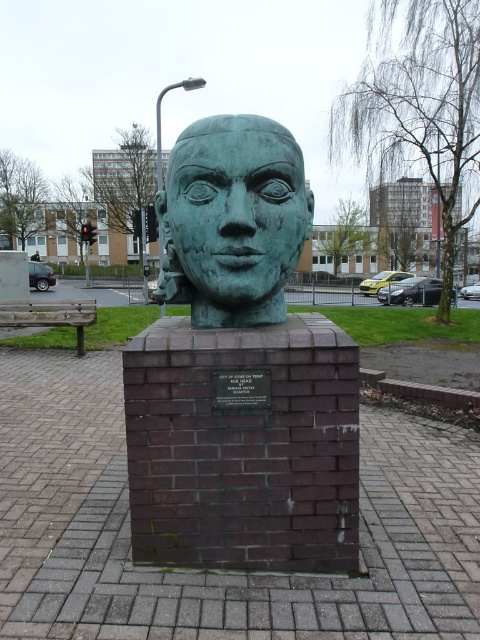
Is green patina stone head at center thinner than green patina head at center?

In fact, green patina stone head at center might be wider than green patina head at center.

The image size is (480, 640). Find the location of `green patina stone head at center`. green patina stone head at center is located at coordinates (240, 372).